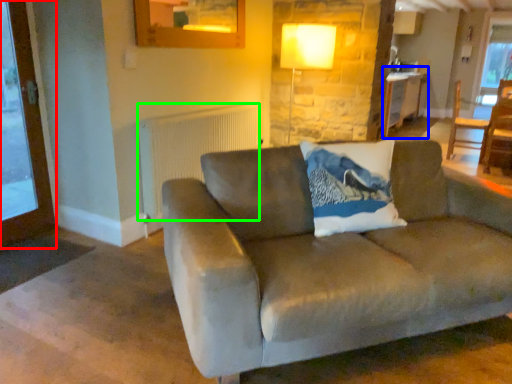
Question: Based on their relative distances, which object is farther from screen door (highlighted by a red box)? Choose from table (highlighted by a blue box) and radiator (highlighted by a green box).

Choices:
 (A) table
 (B) radiator

Answer: (A)